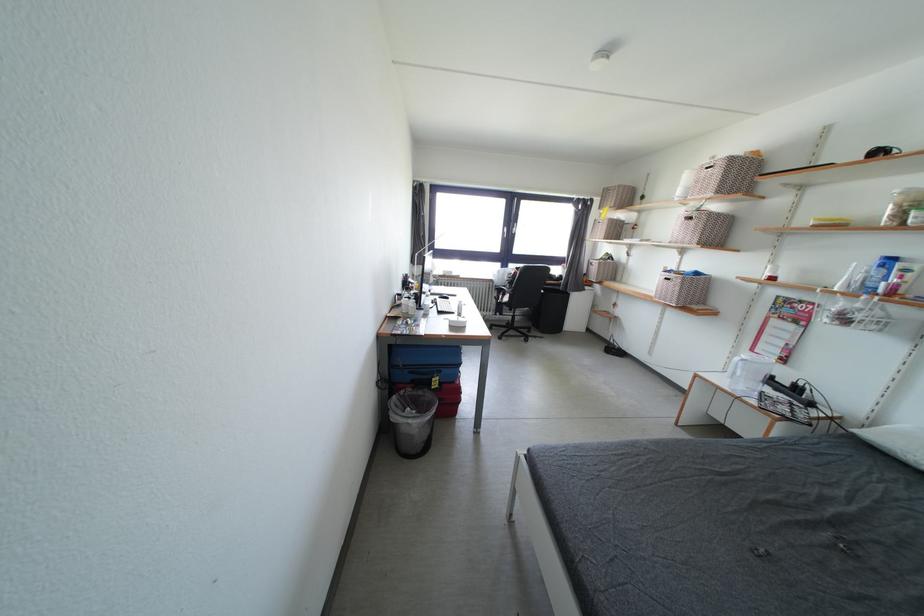
What do you see at coordinates (513, 229) in the screenshot? The image size is (924, 616). I see `a black window handle` at bounding box center [513, 229].